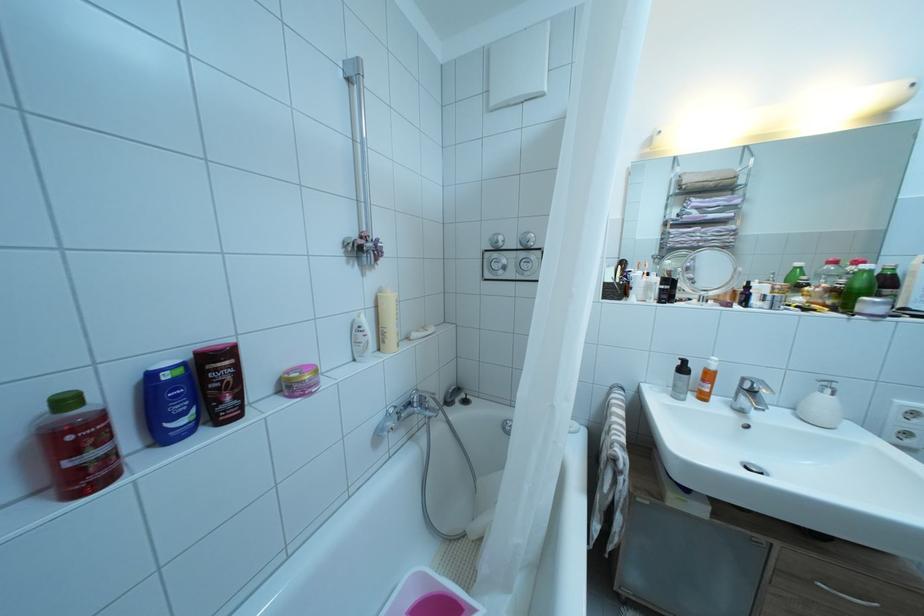
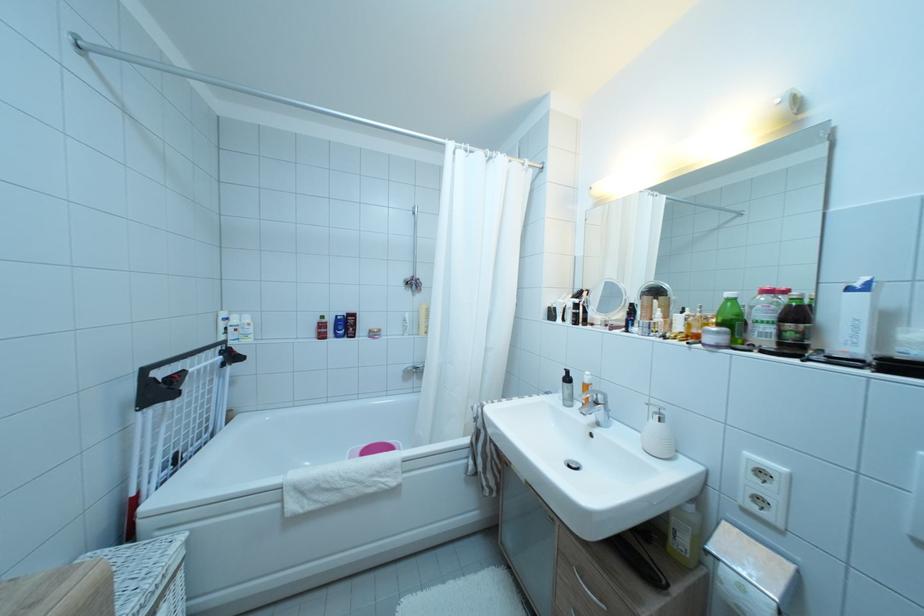
Find the pixel in the second image that matches point (162, 424) in the first image.

(343, 334)